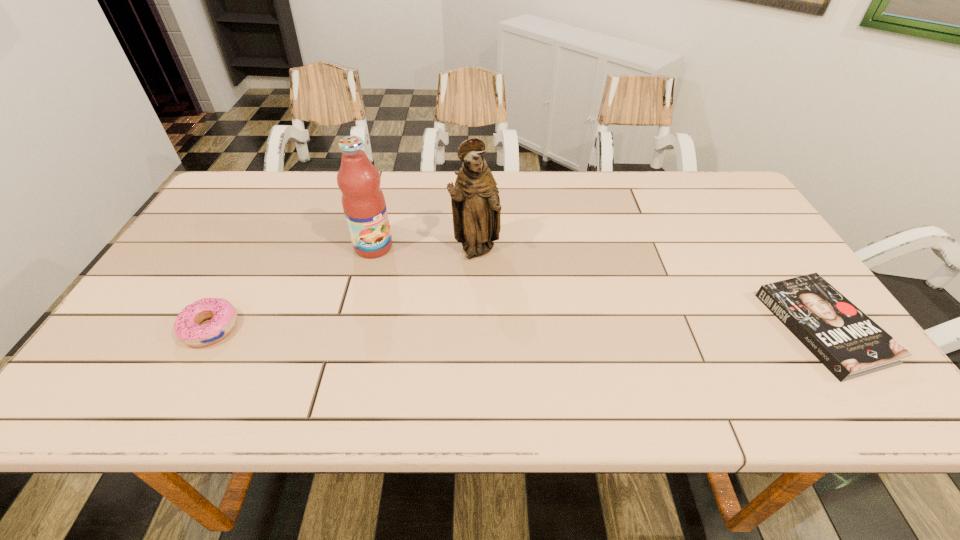
Identify the location of free space between the rightmost object and the third object from right to left. This screenshot has height=540, width=960. (598, 287).

Where is `free spot between the fruit juice and the figurine`? The image size is (960, 540). free spot between the fruit juice and the figurine is located at coordinates (424, 248).

Where is `empty location between the second object from left to right and the doughnut`? The height and width of the screenshot is (540, 960). empty location between the second object from left to right and the doughnut is located at coordinates click(x=292, y=287).

This screenshot has height=540, width=960. What are the coordinates of `free space between the leftmost object and the second object from left to right` in the screenshot? It's located at (292, 287).

I want to click on vacant area between the figurine and the doughnut, so click(x=344, y=288).

Identify which object is located as the third nearest to the shortest object. Please provide its 2D coordinates. Your answer should be formatted as a tuple, i.e. [(x, y)], where the tuple contains the x and y coordinates of a point satisfying the conditions above.

[(224, 316)]

Select which object is the third closest to the third object from right to left. Please provide its 2D coordinates. Your answer should be formatted as a tuple, i.e. [(x, y)], where the tuple contains the x and y coordinates of a point satisfying the conditions above.

[(842, 337)]

The image size is (960, 540). What are the coordinates of `free space that satisfies the following two spatial constraints: 1. on the back side of the second shortest object; 2. on the left side of the figurine` in the screenshot? It's located at (254, 249).

This screenshot has width=960, height=540. In order to click on vacant position in the image that satisfies the following two spatial constraints: 1. on the front side of the third object from right to left; 2. on the right side of the rightmost object in this screenshot , I will do `click(352, 328)`.

Where is `free space that satisfies the following two spatial constraints: 1. on the back side of the doughnut; 2. on the left side of the fruit juice`? Image resolution: width=960 pixels, height=540 pixels. free space that satisfies the following two spatial constraints: 1. on the back side of the doughnut; 2. on the left side of the fruit juice is located at coordinates (255, 247).